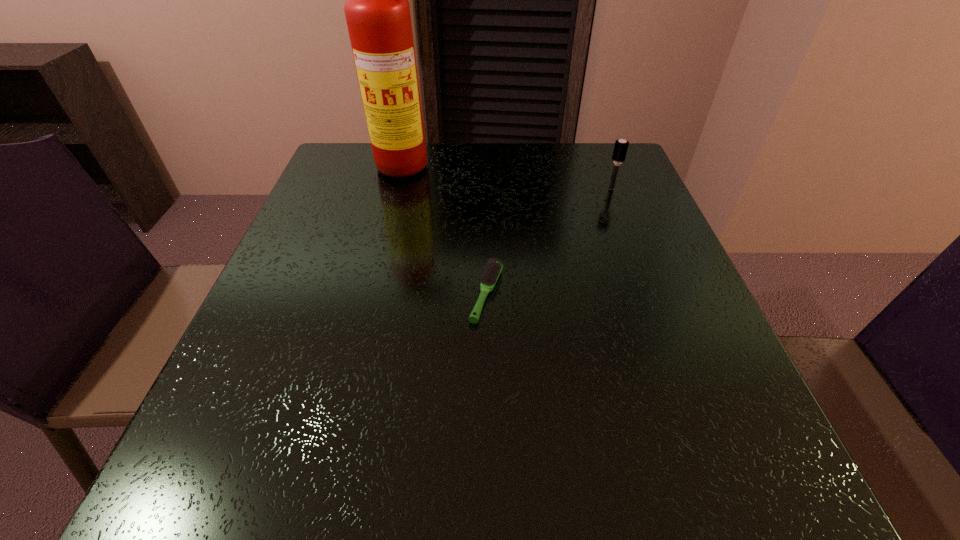
Where is `free space between the leftmost object and the right hairbrush`? This screenshot has width=960, height=540. free space between the leftmost object and the right hairbrush is located at coordinates (511, 177).

Image resolution: width=960 pixels, height=540 pixels. What are the coordinates of `object that stands as the second closest to the farthest object` in the screenshot? It's located at (620, 149).

This screenshot has width=960, height=540. In order to click on object identified as the second closest to the farthest object in this screenshot , I will do `click(620, 149)`.

I want to click on free space that satisfies the following two spatial constraints: 1. on the front-facing side of the rightmost object; 2. on the right side of the tallest object, so click(x=406, y=188).

The height and width of the screenshot is (540, 960). What are the coordinates of `free space in the image that satisfies the following two spatial constraints: 1. on the back side of the second farthest object; 2. on the left side of the shortest object` in the screenshot? It's located at (485, 188).

Locate an element on the screen. The width and height of the screenshot is (960, 540). vacant space that satisfies the following two spatial constraints: 1. on the front-facing side of the second object from left to right; 2. on the right side of the tallest object is located at coordinates (383, 294).

The height and width of the screenshot is (540, 960). What are the coordinates of `free region that satisfies the following two spatial constraints: 1. on the front-facing side of the tallest object; 2. on the left side of the shortest object` in the screenshot? It's located at (383, 294).

I want to click on free space that satisfies the following two spatial constraints: 1. on the front-facing side of the nearest object; 2. on the right side of the fire extinguisher, so click(383, 294).

In order to click on vacant space that satisfies the following two spatial constraints: 1. on the front-facing side of the tallest object; 2. on the right side of the second shortest object in this screenshot , I will do `click(406, 188)`.